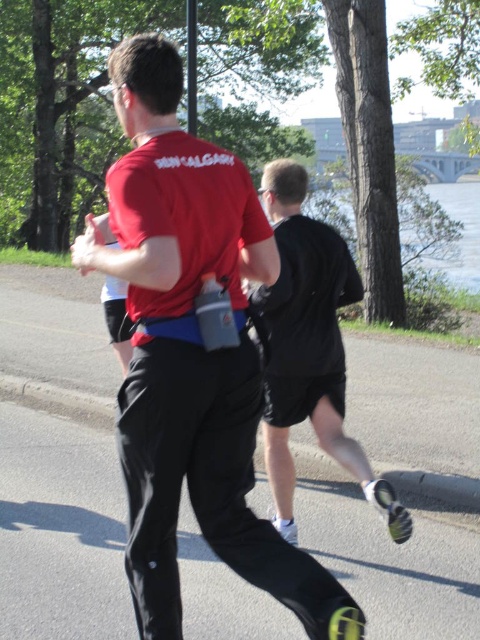
Question: Can you confirm if matte red shirt at center is thinner than black matte shorts at center?

Choices:
 (A) no
 (B) yes

Answer: (A)

Question: Among these objects, which one is nearest to the camera?

Choices:
 (A) black matte shorts at center
 (B) matte red shirt at center

Answer: (B)

Question: Which point is closer to the camera taking this photo?

Choices:
 (A) (229, 358)
 (B) (326, 304)

Answer: (A)

Question: Which point is farther to the camera?

Choices:
 (A) black matte shorts at center
 (B) matte red shirt at center

Answer: (A)

Question: Does matte red shirt at center have a lesser width compared to black matte shorts at center?

Choices:
 (A) yes
 (B) no

Answer: (B)

Question: Can you confirm if matte red shirt at center is positioned to the right of black matte shorts at center?

Choices:
 (A) no
 (B) yes

Answer: (A)